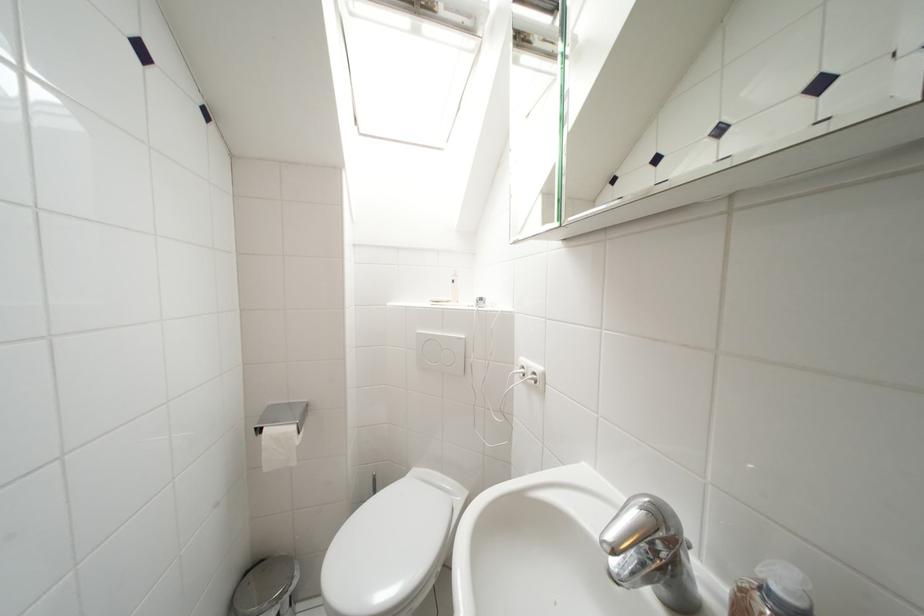
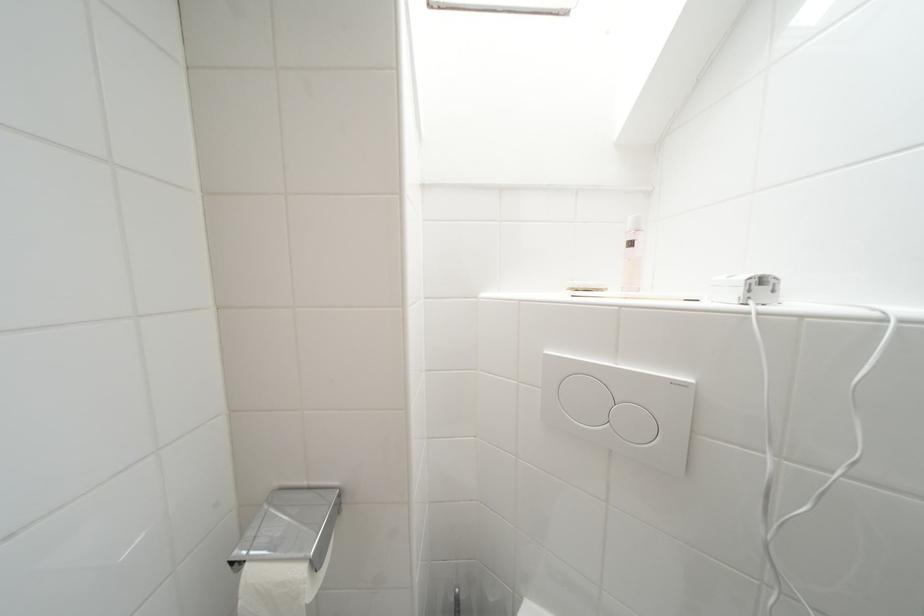
Question: The first image is from the beginning of the video and the second image is from the end. How did the camera likely rotate when shooting the video?

Choices:
 (A) Left
 (B) Right
 (C) Up
 (D) Down

Answer: (A)